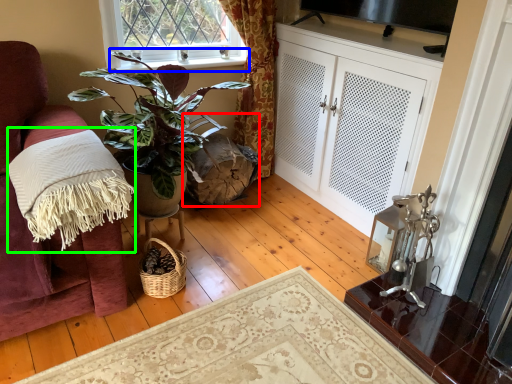
Question: Based on their relative distances, which object is farther from swivel chair (highlighted by a red box)? Choose from window sill (highlighted by a blue box) and blanket (highlighted by a green box).

Choices:
 (A) window sill
 (B) blanket

Answer: (B)